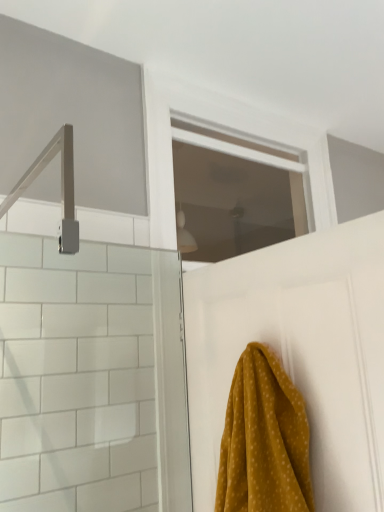
Locate an element on the screen. The image size is (384, 512). mustard yellow fabric at lower right is located at coordinates (264, 440).

Describe the element at coordinates (234, 193) in the screenshot. The height and width of the screenshot is (512, 384). I see `transparent glass window at center` at that location.

Find the location of a particular element. Image resolution: width=384 pixels, height=512 pixels. mustard yellow fabric at lower right is located at coordinates (264, 440).

Who is bigger, mustard yellow fabric at lower right or transparent glass window at center?

transparent glass window at center.

From the picture: Is mustard yellow fabric at lower right oriented towards transparent glass window at center?

No, mustard yellow fabric at lower right is not facing towards transparent glass window at center.

Is mustard yellow fabric at lower right next to transparent glass window at center?

No, mustard yellow fabric at lower right is not in contact with transparent glass window at center.

Is white matte door at upper center not near mustard yellow fabric at lower right?

white matte door at upper center is near mustard yellow fabric at lower right, not far away.

Looking at the image, does white matte door at upper center seem bigger or smaller compared to mustard yellow fabric at lower right?

white matte door at upper center is bigger than mustard yellow fabric at lower right.

Can mustard yellow fabric at lower right be found inside white matte door at upper center?

No, white matte door at upper center does not contain mustard yellow fabric at lower right.

Consider the image. Considering the relative positions of white matte door at upper center and mustard yellow fabric at lower right in the image provided, is white matte door at upper center to the left or to the right of mustard yellow fabric at lower right?

white matte door at upper center is to the right of mustard yellow fabric at lower right.

Is transparent glass window at center outside of mustard yellow fabric at lower right?

Absolutely, transparent glass window at center is external to mustard yellow fabric at lower right.

Considering the sizes of objects transparent glass window at center and mustard yellow fabric at lower right in the image provided, who is thinner, transparent glass window at center or mustard yellow fabric at lower right?

transparent glass window at center is thinner.

From the image's perspective, is transparent glass window at center beneath mustard yellow fabric at lower right?

Incorrect, from the image's perspective, transparent glass window at center is higher than mustard yellow fabric at lower right.

Is transparent glass window at center far from mustard yellow fabric at lower right?

That's right, there is a large distance between transparent glass window at center and mustard yellow fabric at lower right.

Considering the positions of objects white matte door at upper center and transparent glass window at center in the image provided, who is more to the right, white matte door at upper center or transparent glass window at center?

white matte door at upper center.

Between point (223, 274) and point (223, 158), which one is positioned in front?

The point (223, 274) is closer.

Could you tell me if white matte door at upper center is turned towards transparent glass window at center?

Yes, white matte door at upper center is oriented towards transparent glass window at center.

Which object is further away from the camera taking this photo, white matte door at upper center or transparent glass window at center?

Positioned behind is transparent glass window at center.

Which point is more distant from viewer, (304,430) or (357,361)?

Positioned behind is point (304,430).

From a real-world perspective, which is physically above, mustard yellow fabric at lower right or white matte door at upper center?

In real-world perspective, white matte door at upper center is above.

Is mustard yellow fabric at lower right beside white matte door at upper center?

No, mustard yellow fabric at lower right is not next to white matte door at upper center.

Between mustard yellow fabric at lower right and white matte door at upper center, which one is positioned in front?

mustard yellow fabric at lower right is closer to the camera.

Is transparent glass window at center to the right of white matte door at upper center from the viewer's perspective?

In fact, transparent glass window at center is to the left of white matte door at upper center.

Looking at this image, from a real-world perspective, is transparent glass window at center physically located above or below white matte door at upper center?

transparent glass window at center is above white matte door at upper center.

From the image's perspective, which one is positioned higher, transparent glass window at center or white matte door at upper center?

transparent glass window at center is shown above in the image.

Find the location of a particular element. This screenshot has height=512, width=384. door in front of the transparent glass window at center is located at coordinates (298, 353).

The image size is (384, 512). I want to click on window above the mustard yellow fabric at lower right (from a real-world perspective), so click(234, 193).

Where is `door that appears above the mustard yellow fabric at lower right (from the image's perspective)`? This screenshot has height=512, width=384. door that appears above the mustard yellow fabric at lower right (from the image's perspective) is located at coordinates (298, 353).

When comparing their distances from transparent glass window at center, does white matte door at upper center or mustard yellow fabric at lower right seem closer?

white matte door at upper center.

When comparing their distances from transparent glass window at center, does mustard yellow fabric at lower right or white matte door at upper center seem further?

mustard yellow fabric at lower right is further to transparent glass window at center.

Which object lies nearer to the anchor point white matte door at upper center, transparent glass window at center or mustard yellow fabric at lower right?

mustard yellow fabric at lower right is closer to white matte door at upper center.

From the image, which object appears to be nearer to mustard yellow fabric at lower right, transparent glass window at center or white matte door at upper center?

white matte door at upper center is closer to mustard yellow fabric at lower right.

Considering their positions, is white matte door at upper center positioned further to mustard yellow fabric at lower right than transparent glass window at center?

transparent glass window at center.

Considering their positions, is mustard yellow fabric at lower right positioned closer to white matte door at upper center than transparent glass window at center?

mustard yellow fabric at lower right lies closer to white matte door at upper center than the other object.

The width and height of the screenshot is (384, 512). Identify the location of door between mustard yellow fabric at lower right and transparent glass window at center in the front-back direction. (298, 353).